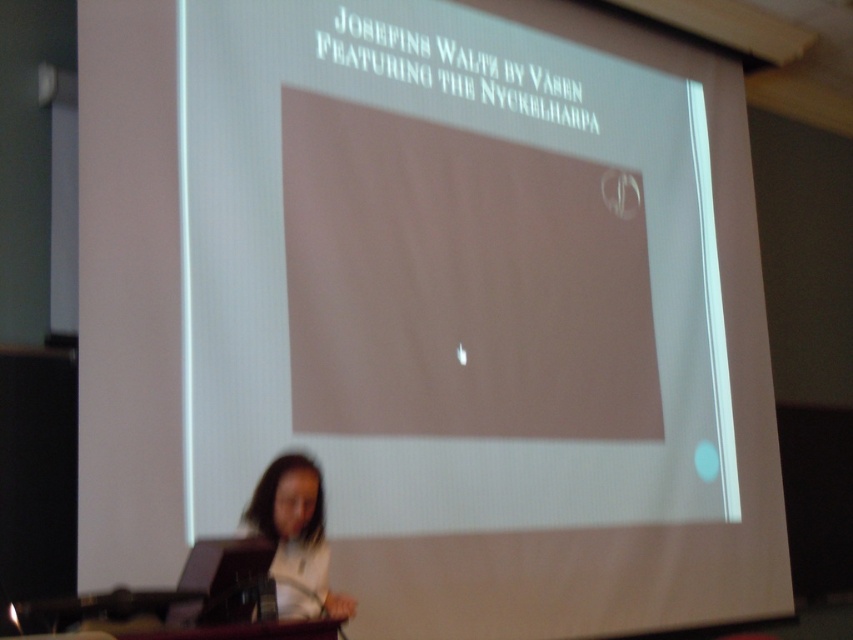
Question: Is white matte projection screen at center closer to camera compared to white matte hair at lower left?

Choices:
 (A) no
 (B) yes

Answer: (A)

Question: Among these objects, which one is nearest to the camera?

Choices:
 (A) white matte projection screen at center
 (B) white matte hair at lower left

Answer: (B)

Question: Does white matte projection screen at center appear on the left side of white matte hair at lower left?

Choices:
 (A) no
 (B) yes

Answer: (A)

Question: Is white matte projection screen at center closer to the viewer compared to white matte hair at lower left?

Choices:
 (A) yes
 (B) no

Answer: (B)

Question: Among these points, which one is nearest to the camera?

Choices:
 (A) (312, 572)
 (B) (265, 378)

Answer: (A)